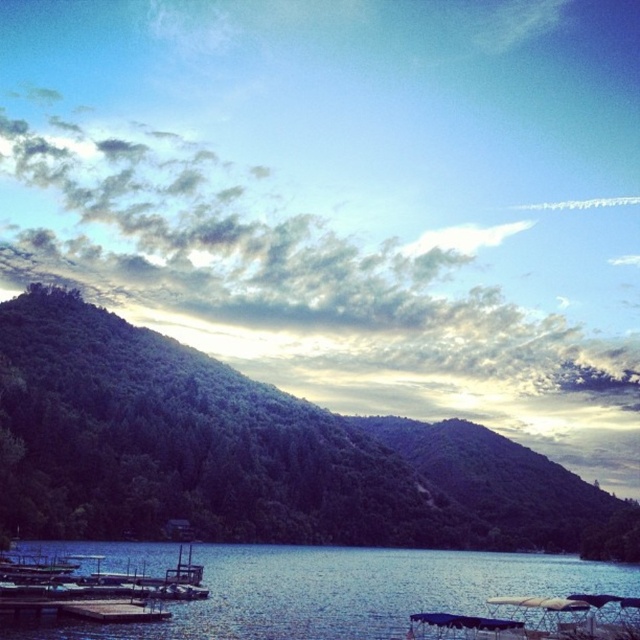
Can you confirm if blue water at lower center is wider than brown wooden dock at lower left?

Yes.

Does point (540, 556) come in front of point (51, 600)?

No.

Which is in front, point (253, 556) or point (0, 611)?

Positioned in front is point (0, 611).

The width and height of the screenshot is (640, 640). What are the coordinates of `blue water at lower center` in the screenshot? It's located at (344, 592).

Can you confirm if green forested hill at center is smaller than blue water at lower center?

No.

Between green forested hill at center and blue water at lower center, which one has less height?

Standing shorter between the two is blue water at lower center.

Is point (262, 400) in front of point (342, 595)?

No, (262, 400) is behind (342, 595).

Find the location of a particular element. The height and width of the screenshot is (640, 640). green forested hill at center is located at coordinates (257, 452).

Can you confirm if green forested hill at center is positioned below brown wooden dock at lower left?

Yes, green forested hill at center is below brown wooden dock at lower left.

Does green forested hill at center have a lesser height compared to brown wooden dock at lower left?

In fact, green forested hill at center may be taller than brown wooden dock at lower left.

Is point (8, 509) farther from viewer compared to point (65, 605)?

Yes, it is behind point (65, 605).

The width and height of the screenshot is (640, 640). What are the coordinates of `green forested hill at center` in the screenshot? It's located at (257, 452).